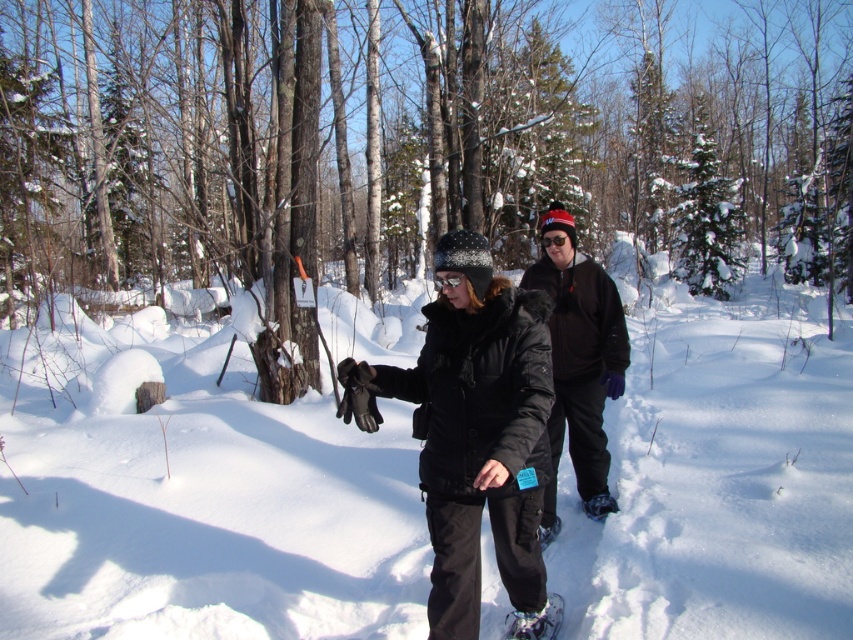
The image size is (853, 640). I want to click on smooth bark tree at center, so click(404, 147).

Who is lower down, black matte jacket at center or black fleece jacket at center?

Positioned lower is black matte jacket at center.

Does black matte jacket at center appear over black fleece jacket at center?

Incorrect, black matte jacket at center is not positioned above black fleece jacket at center.

The width and height of the screenshot is (853, 640). I want to click on black matte jacket at center, so click(x=473, y=428).

Find the location of a particular element. black matte jacket at center is located at coordinates (473, 428).

I want to click on black fleece jacket at center, so click(x=578, y=353).

Locate an element on the screen. The image size is (853, 640). black fleece jacket at center is located at coordinates (578, 353).